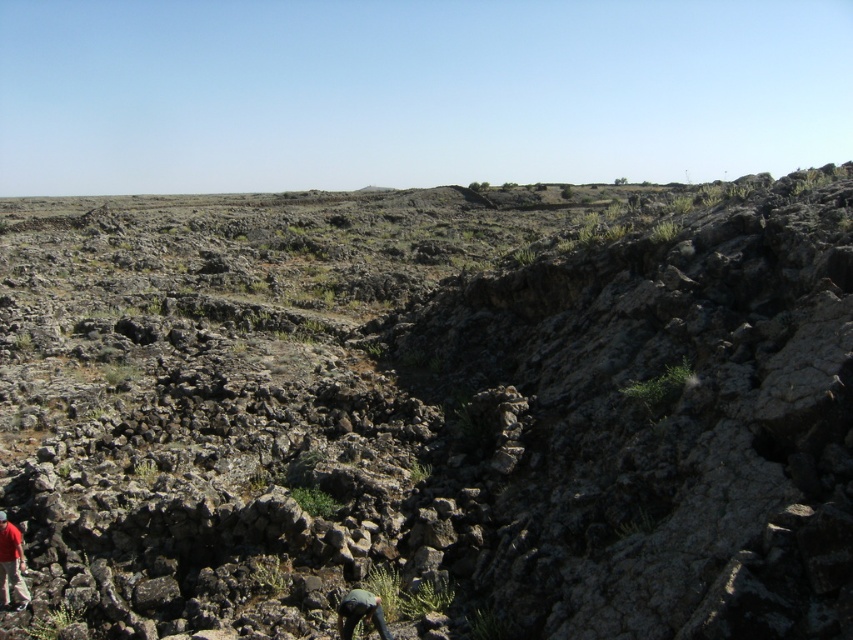
You are planning to set up a small tent for a quick camp. You have a tent that requires a minimum of 3 square meters of flat space. Looking at the rocky terrain at center and the dark gray fabric at lower center, which location would provide enough space for the tent?

The rocky terrain at center has a larger width than the dark gray fabric at lower center, so the rocky terrain at center is more likely to provide enough space for the tent.

You are a hiker who has just started exploring the rugged, rocky landscape. You notice the red fabric shirt at lower left and the rocky terrain at center. How far apart are these two landmarks?

The distance between the red fabric shirt at lower left and the rocky terrain at center is 18.54 meters.